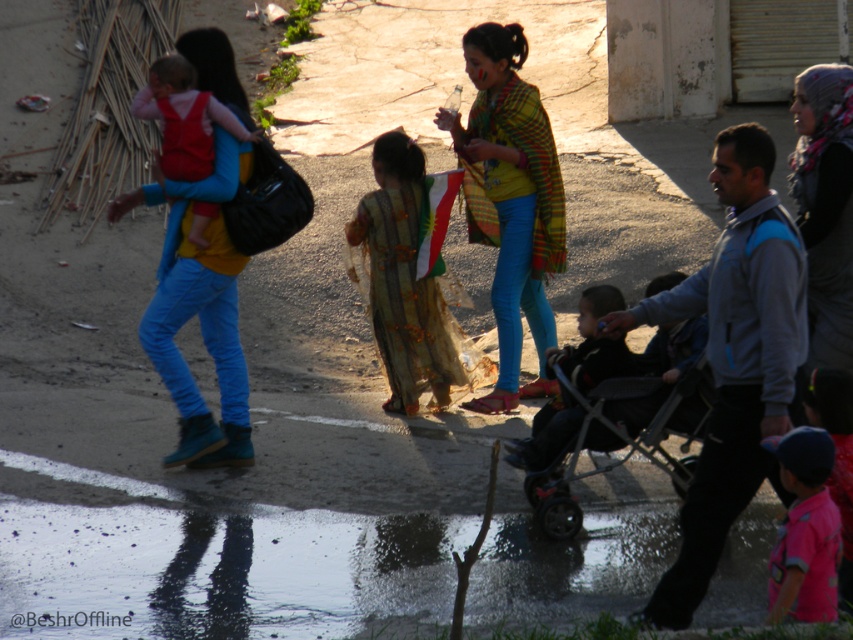
Question: Which point appears farthest from the camera in this image?

Choices:
 (A) 195,29
 (B) 622,412

Answer: (A)

Question: Which of the following is the farthest from the observer?

Choices:
 (A) (804, 612)
 (B) (148, 324)

Answer: (B)

Question: Is gray fleece jacket at center to the left of yellow fabric scarf at center from the viewer's perspective?

Choices:
 (A) no
 (B) yes

Answer: (A)

Question: Which object appears farthest from the camera in this image?

Choices:
 (A) dark blue fabric stroller at center
 (B) metallic gray stroller at center
 (C) pink fabric at lower right
 (D) matte red vest at upper left

Answer: (D)

Question: Can you confirm if matte yellow shirt at left is smaller than black knit scarf at upper right?

Choices:
 (A) no
 (B) yes

Answer: (A)

Question: Does pink fabric at lower right appear on the left side of matte red vest at upper left?

Choices:
 (A) yes
 (B) no

Answer: (B)